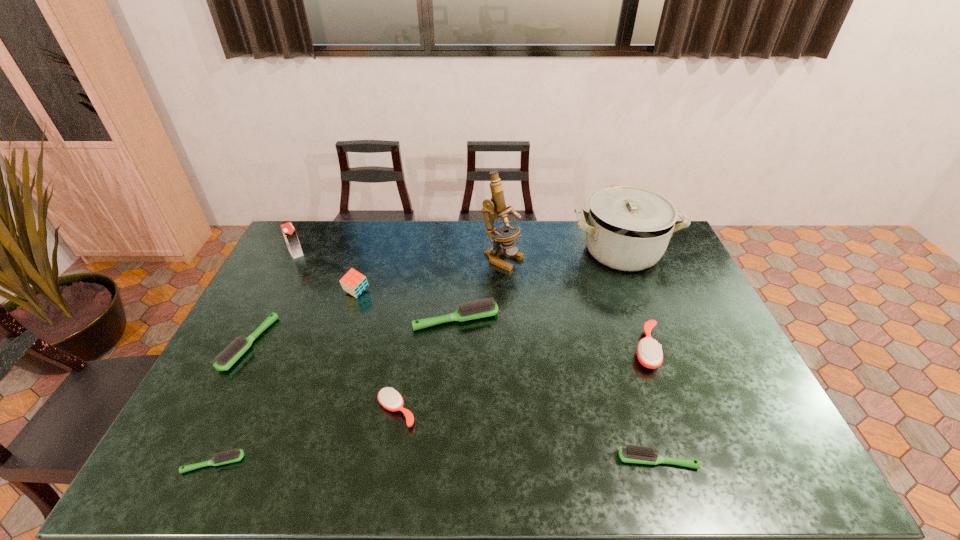
Where is `empty space between the smallest light hairbrush and the second light hairbrush from right to left`? empty space between the smallest light hairbrush and the second light hairbrush from right to left is located at coordinates (335, 391).

Identify the location of vacant space in between the second shortest hairbrush and the right orange hairbrush. (652, 404).

Locate an element on the screen. Image resolution: width=960 pixels, height=540 pixels. free space between the third smallest light hairbrush and the tallest object is located at coordinates (375, 301).

Find the location of a particular element. The image size is (960, 540). vacant region between the bigger orange hairbrush and the saucepan is located at coordinates (635, 300).

Where is `free space that is in between the third tallest object and the cube`? free space that is in between the third tallest object and the cube is located at coordinates (x=326, y=273).

In order to click on unoccupied area between the third tallest object and the bigger orange hairbrush in this screenshot , I will do `click(471, 301)`.

Find the location of a particular element. unoccupied area between the bigger orange hairbrush and the third light hairbrush from left to right is located at coordinates (551, 334).

You are a GUI agent. You are given a task and a screenshot of the screen. Output one action in this format:
    pyautogui.click(x=<x>, y=<y>)
    Task: Click on the vacant area that lies between the third smallest light hairbrush and the microscope
    The width and height of the screenshot is (960, 540).
    Given the screenshot: What is the action you would take?
    pyautogui.click(x=375, y=301)

Find the location of a particular element. This screenshot has width=960, height=540. free space between the saucepan and the eighth shortest object is located at coordinates (459, 252).

What are the coordinates of `empty space that is in between the microscope and the ninth shortest object` in the screenshot? It's located at (563, 255).